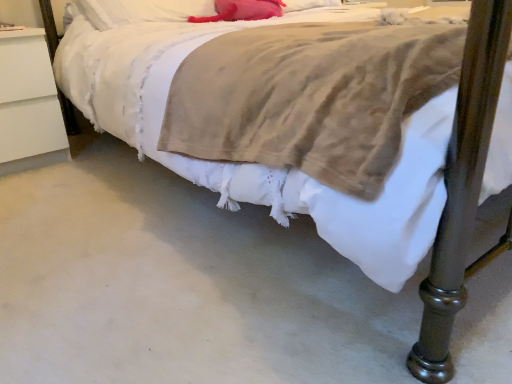
Question: From a real-world perspective, is matte pink pillow at upper center, the 2th pillow positioned from the left, physically above white soft pillow at upper center, acting as the 1th pillow starting from the left?

Choices:
 (A) yes
 (B) no

Answer: (B)

Question: Is white soft pillow at upper center, which is counted as the 2th pillow, starting from the right, inside matte pink pillow at upper center, the 2th pillow positioned from the left?

Choices:
 (A) yes
 (B) no

Answer: (B)

Question: From a real-world perspective, is matte pink pillow at upper center, the 2th pillow positioned from the left, below white soft pillow at upper center, acting as the 1th pillow starting from the left?

Choices:
 (A) no
 (B) yes

Answer: (B)

Question: Is matte pink pillow at upper center, the 1th pillow positioned from the right, outside of white soft pillow at upper center, which is counted as the 2th pillow, starting from the right?

Choices:
 (A) no
 (B) yes

Answer: (A)

Question: Is matte pink pillow at upper center, the 1th pillow positioned from the right, in contact with white soft pillow at upper center, acting as the 1th pillow starting from the left?

Choices:
 (A) no
 (B) yes

Answer: (A)

Question: From the image's perspective, is matte pink pillow at upper center, the 2th pillow positioned from the left, located above white soft pillow at upper center, acting as the 1th pillow starting from the left?

Choices:
 (A) yes
 (B) no

Answer: (A)

Question: Does white soft pillow at upper center, acting as the 1th pillow starting from the left, come behind white matte nightstand at left?

Choices:
 (A) no
 (B) yes

Answer: (B)

Question: Does white soft pillow at upper center, which is counted as the 2th pillow, starting from the right, turn towards white matte nightstand at left?

Choices:
 (A) yes
 (B) no

Answer: (B)

Question: From a real-world perspective, does white soft pillow at upper center, acting as the 1th pillow starting from the left, stand above white matte nightstand at left?

Choices:
 (A) yes
 (B) no

Answer: (A)

Question: Can you confirm if white soft pillow at upper center, which is counted as the 2th pillow, starting from the right, is thinner than white matte nightstand at left?

Choices:
 (A) no
 (B) yes

Answer: (B)

Question: Can you confirm if white soft pillow at upper center, which is counted as the 2th pillow, starting from the right, is bigger than white matte nightstand at left?

Choices:
 (A) no
 (B) yes

Answer: (A)

Question: Is white soft pillow at upper center, which is counted as the 2th pillow, starting from the right, shorter than white matte nightstand at left?

Choices:
 (A) yes
 (B) no

Answer: (A)

Question: Does white matte nightstand at left touch white soft pillow at upper center, which is counted as the 2th pillow, starting from the right?

Choices:
 (A) yes
 (B) no

Answer: (B)